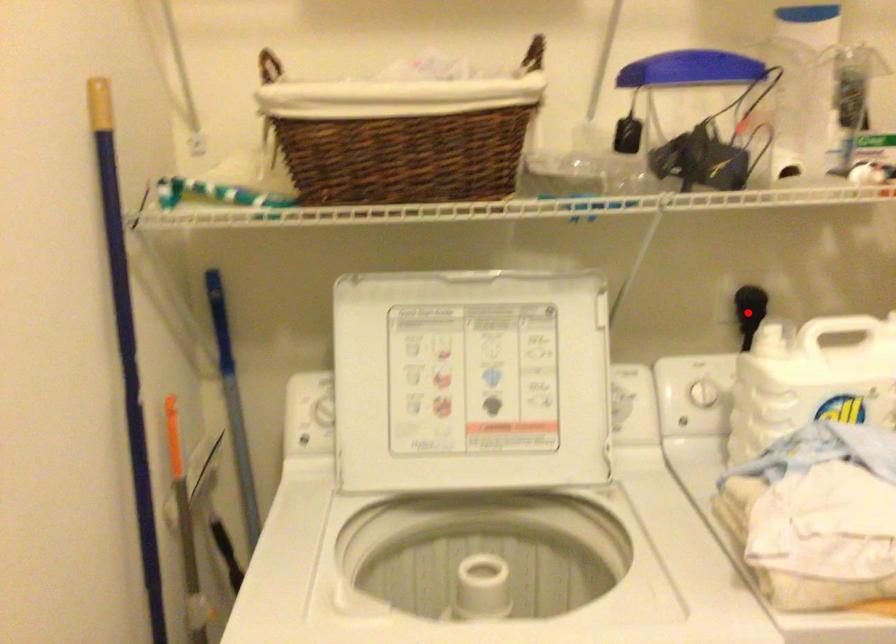
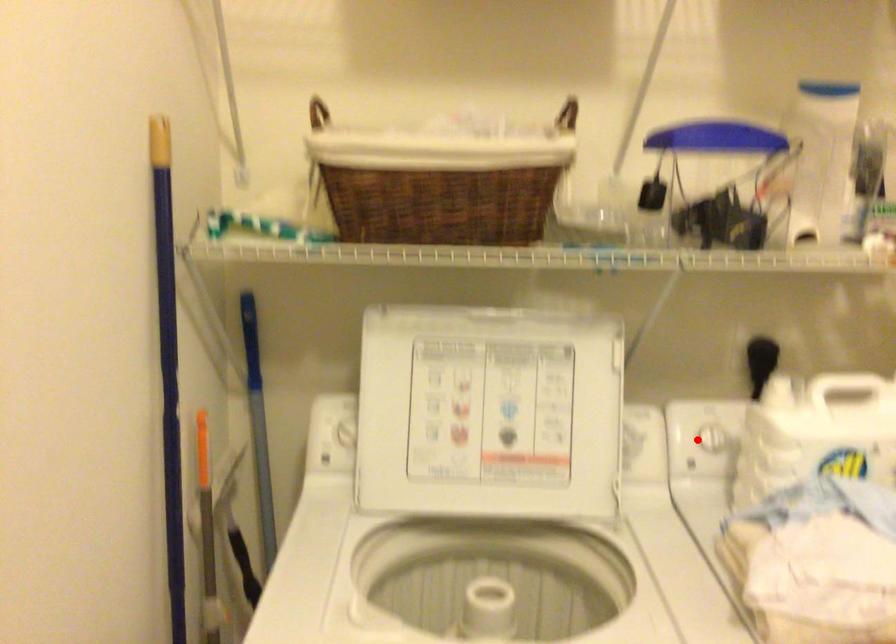
I am providing you with two images of the same scene from different viewpoints. A red point is marked on the first image and another point is marked on the second image. Do the highlighted points in image1 and image2 indicate the same real-world spot?

No